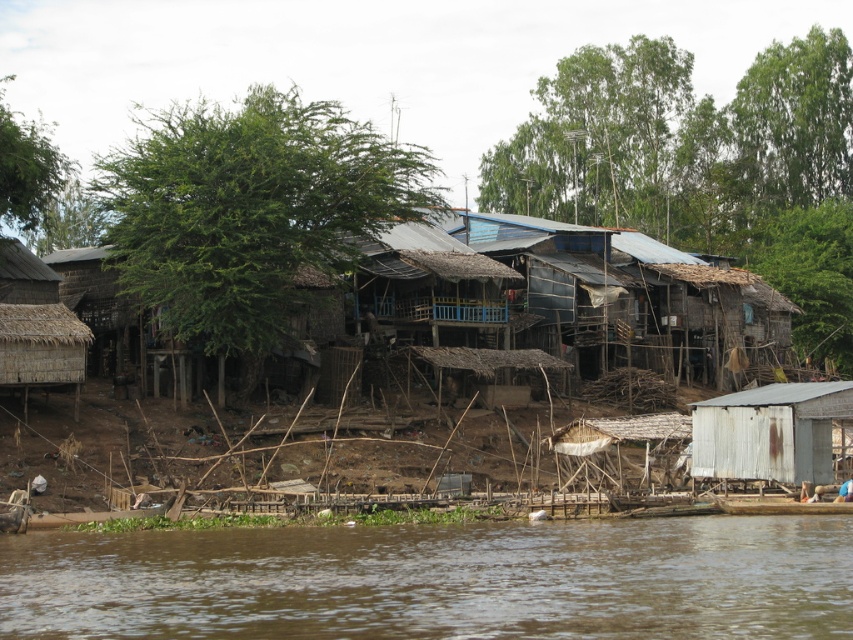
Is brown muddy water at lower center further to camera compared to white weathered shack at lower right?

That is False.

Which of these two, brown muddy water at lower center or white weathered shack at lower right, stands shorter?

brown muddy water at lower center is shorter.

The image size is (853, 640). Identify the location of brown muddy water at lower center. coord(438,580).